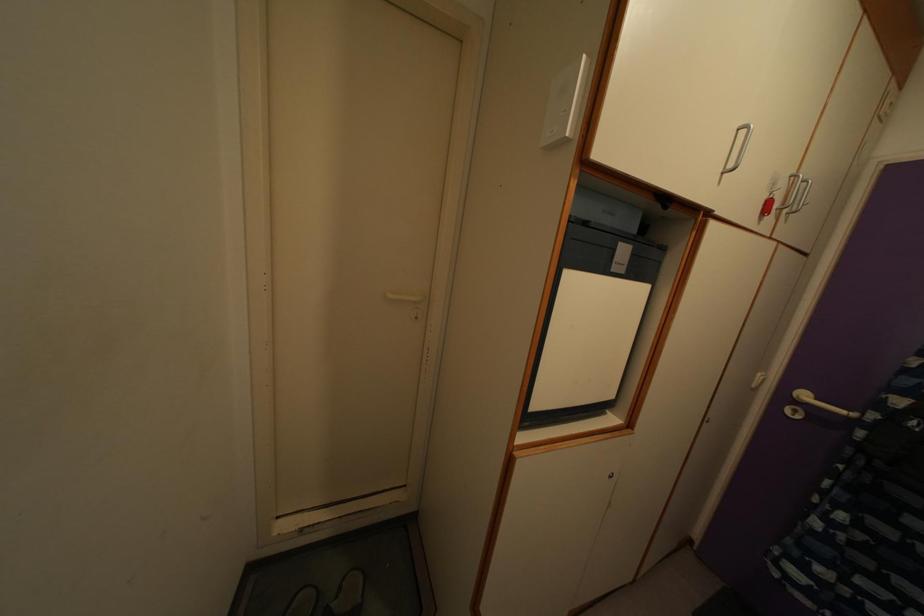
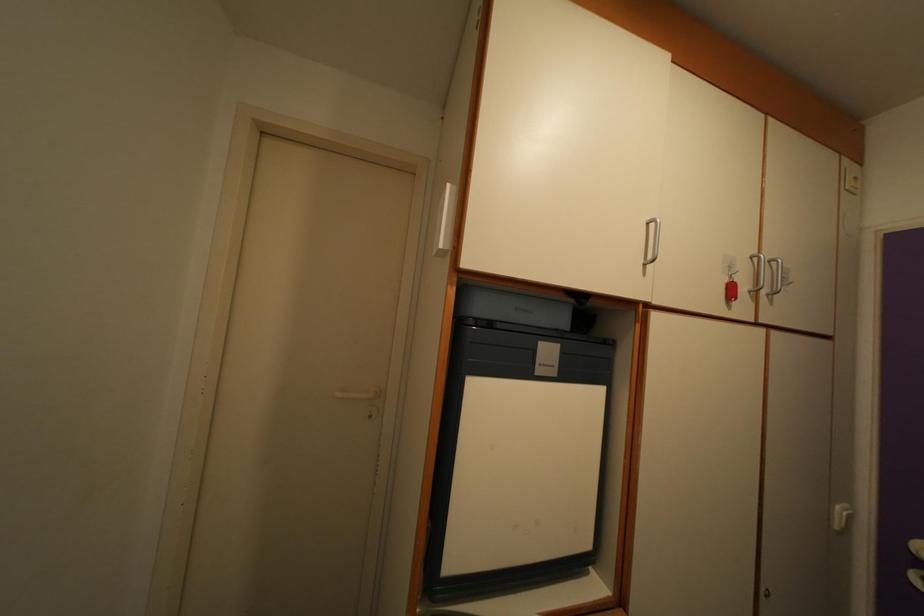
Where in the second image is the point corresponding to pixel 614 406 from the first image?

(591, 554)